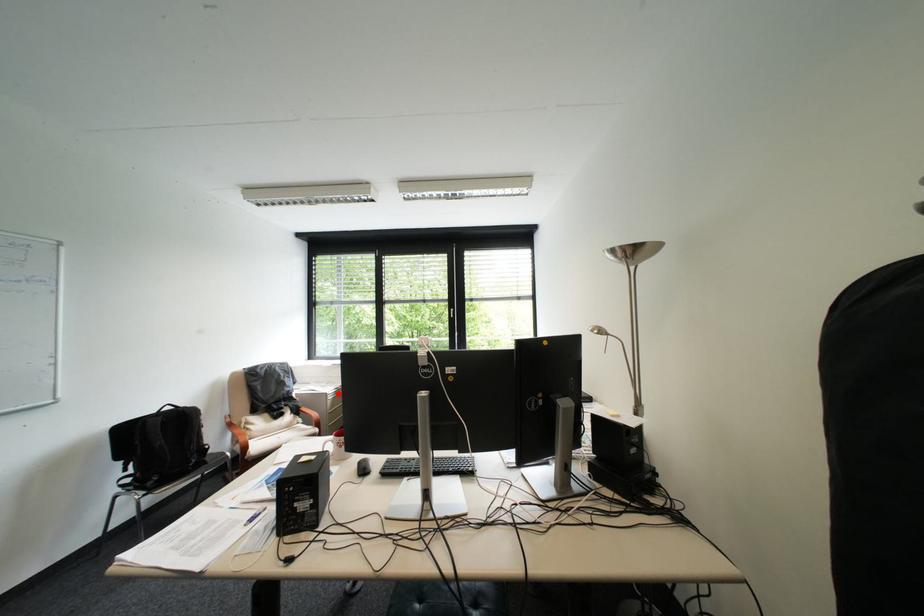
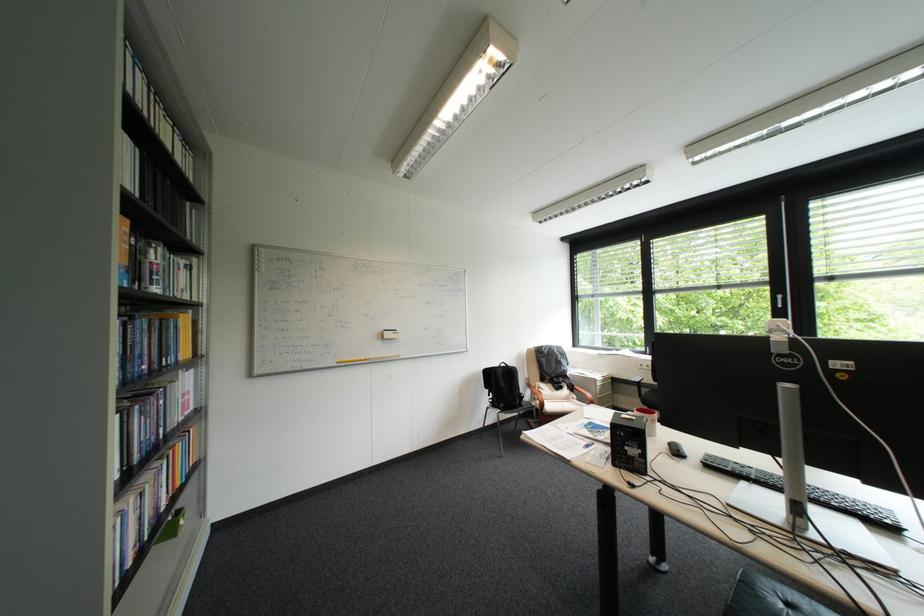
Where in the second image is the point corresponding to the highlighted location from the first image?

(608, 379)